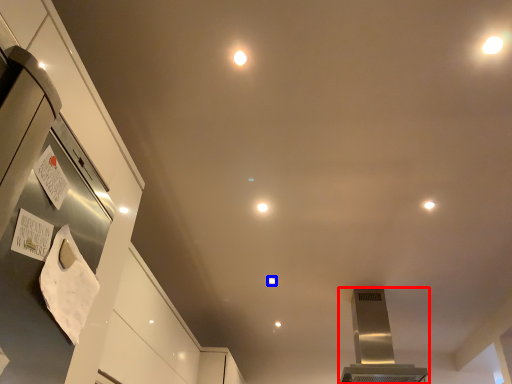
Question: Which of the following is the farthest to the observer, home appliance (highlighted by a red box) or light (highlighted by a blue box)?

Choices:
 (A) home appliance
 (B) light

Answer: (B)